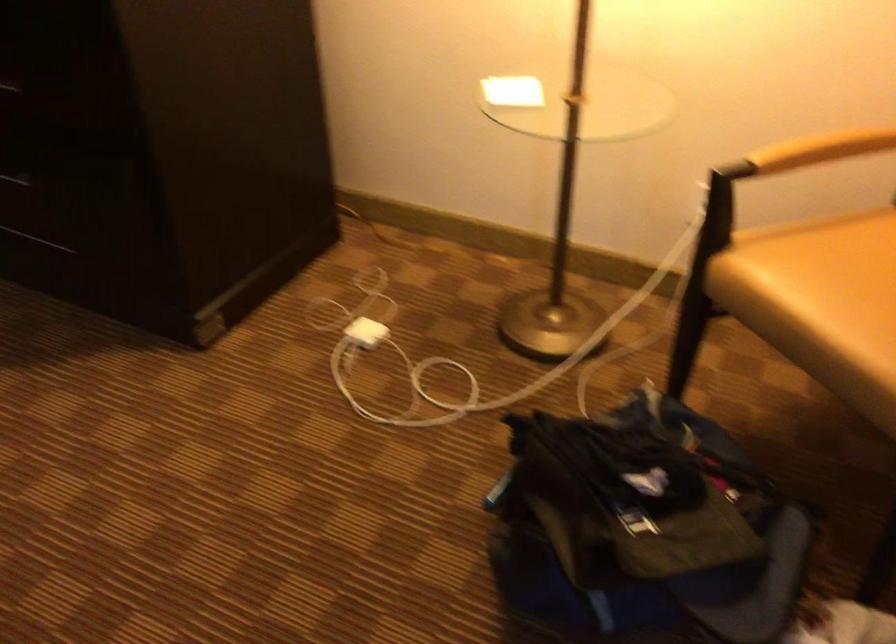
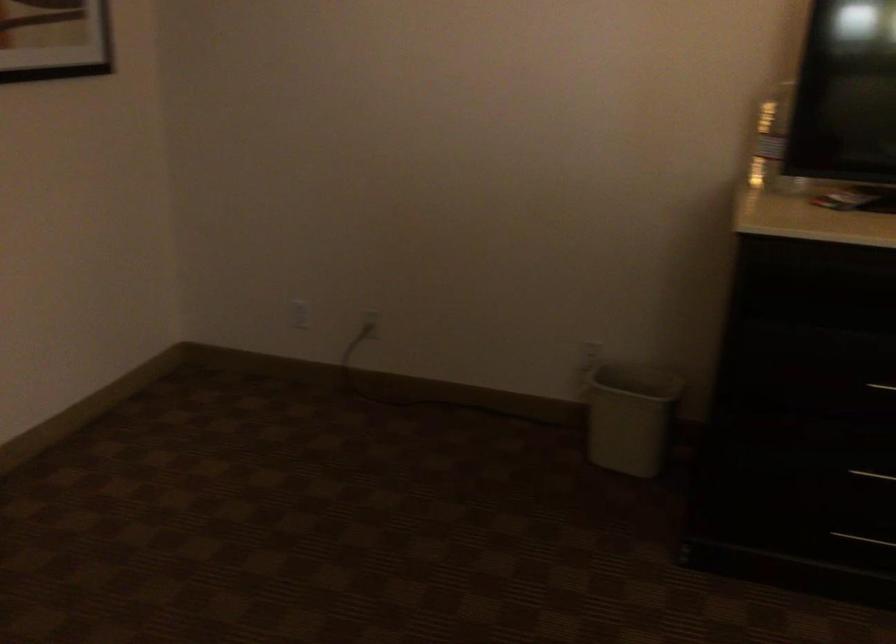
Question: What movement of the cameraman would produce the second image?

Choices:
 (A) Left
 (B) Right
 (C) Forward
 (D) Backward

Answer: (A)